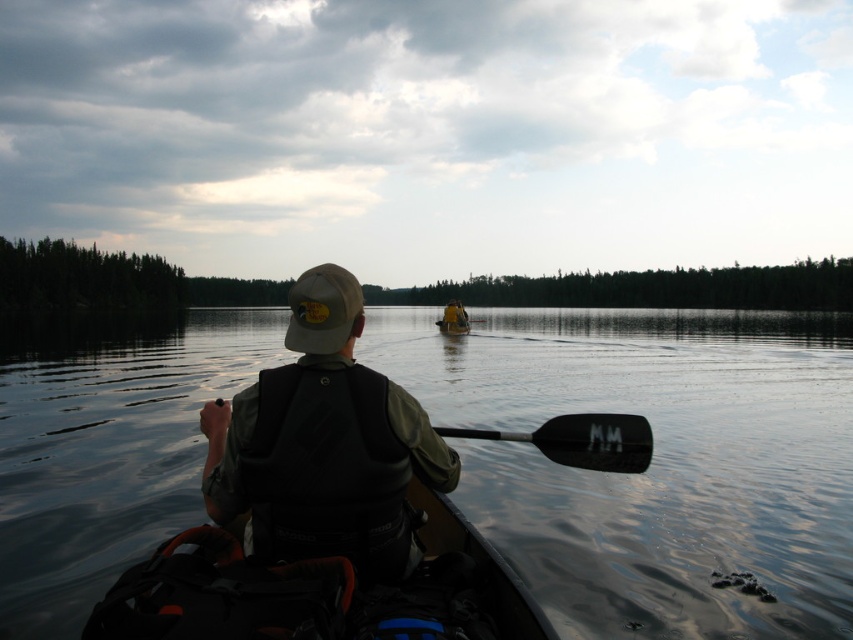
Question: Is black smooth paddle at lower center in front of matte black kayak at center?

Choices:
 (A) no
 (B) yes

Answer: (B)

Question: Among these points, which one is nearest to the camera?

Choices:
 (A) (457, 326)
 (B) (457, 301)
 (C) (479, 321)
 (D) (637, 323)

Answer: (A)

Question: Does transparent water at center appear on the right side of yellow plastic canoe at center?

Choices:
 (A) no
 (B) yes

Answer: (A)

Question: Is matte black kayak at center further to camera compared to black rubber paddle at center?

Choices:
 (A) no
 (B) yes

Answer: (A)

Question: Which point appears farthest from the camera in this image?

Choices:
 (A) (468, 330)
 (B) (184, 442)

Answer: (A)

Question: Which of the following is the closest to the observer?

Choices:
 (A) black rubber paddle at center
 (B) yellow fabric boat at center
 (C) yellow plastic canoe at center
 (D) matte black kayak at center

Answer: (D)